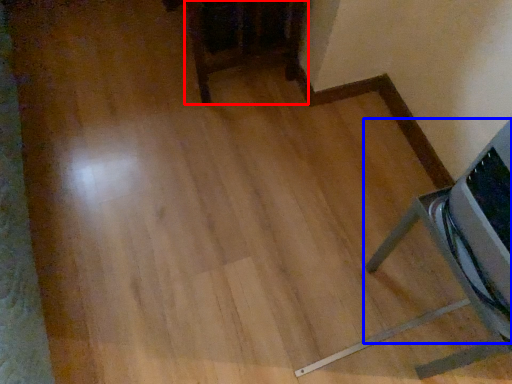
Question: Which object appears farthest to the camera in this image, furniture (highlighted by a red box) or furniture (highlighted by a blue box)?

Choices:
 (A) furniture
 (B) furniture

Answer: (A)